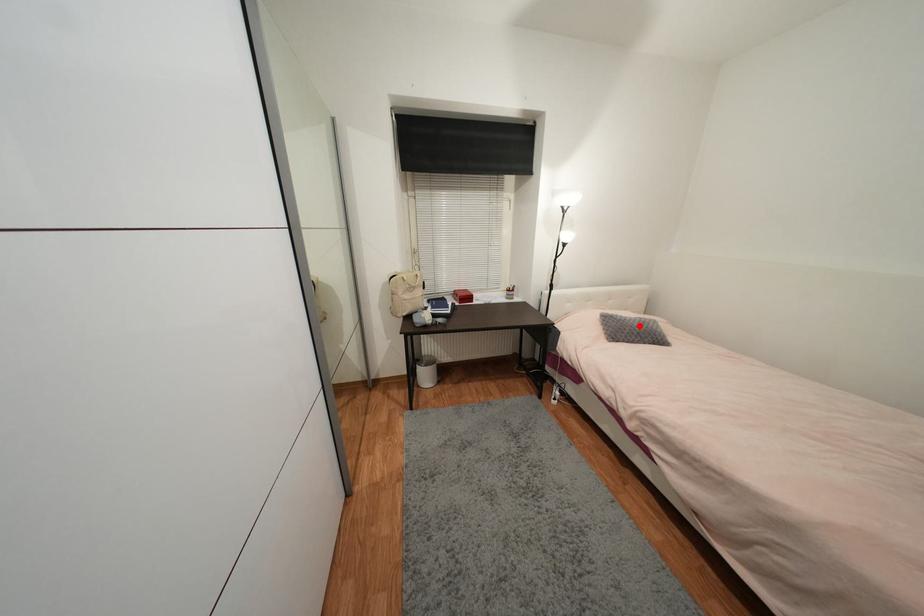
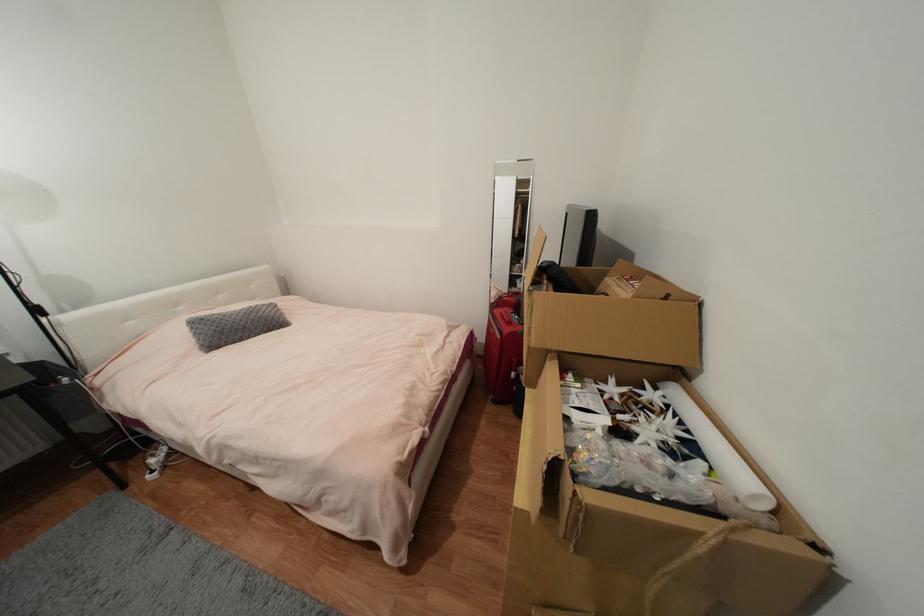
Question: I am providing you with two images of the same scene from different viewpoints. Image1 has a red point marked. In image2, the corresponding 3D location appears at what relative position? Reply with the corresponding letter.

Choices:
 (A) Closer
 (B) Farther

Answer: (A)